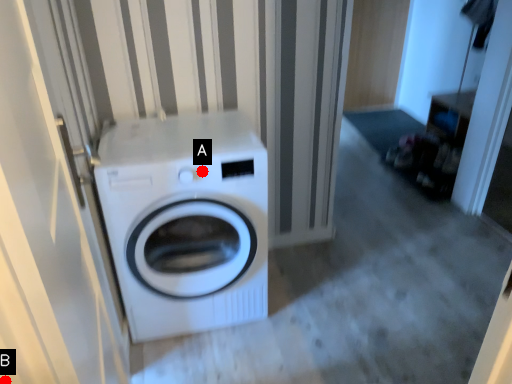
Question: Two points are circled on the image, labeled by A and B beside each circle. Which point is farther to the camera?

Choices:
 (A) A is further
 (B) B is further

Answer: (A)